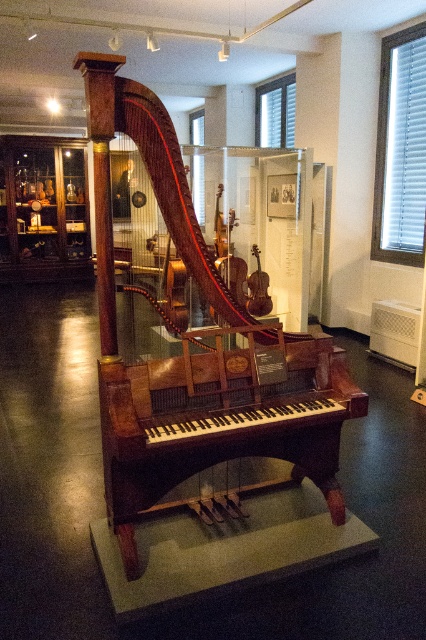
Can you confirm if wooden harpsichord at center is smaller than mahogany wood harpsichord at center?

No.

Is wooden harpsichord at center bigger than mahogany wood harpsichord at center?

Yes, wooden harpsichord at center is bigger than mahogany wood harpsichord at center.

You are a GUI agent. You are given a task and a screenshot of the screen. Output one action in this format:
    pyautogui.click(x=<x>, y=<y>)
    Task: Click on the wooden harpsichord at center
    
    Given the screenshot: What is the action you would take?
    pyautogui.click(x=199, y=392)

The image size is (426, 640). Identify the location of mahogany wood harpsichord at center. (221, 419).

Which is in front, point (210, 397) or point (262, 285)?

Point (210, 397) is in front.

This screenshot has width=426, height=640. I want to click on mahogany wood harpsichord at center, so click(221, 419).

Based on the photo, which is above, wooden harpsichord at center or wooden violin at center?

Positioned higher is wooden harpsichord at center.

Is wooden harpsichord at center to the left of wooden violin at center from the viewer's perspective?

Correct, you'll find wooden harpsichord at center to the left of wooden violin at center.

Is point (129, 515) behind point (265, 305)?

No, it is in front of (265, 305).

At what (x,y) coordinates should I click in order to perform the action: click on wooden harpsichord at center. Please return your answer as a coordinate pair (x, y). Looking at the image, I should click on (199, 392).